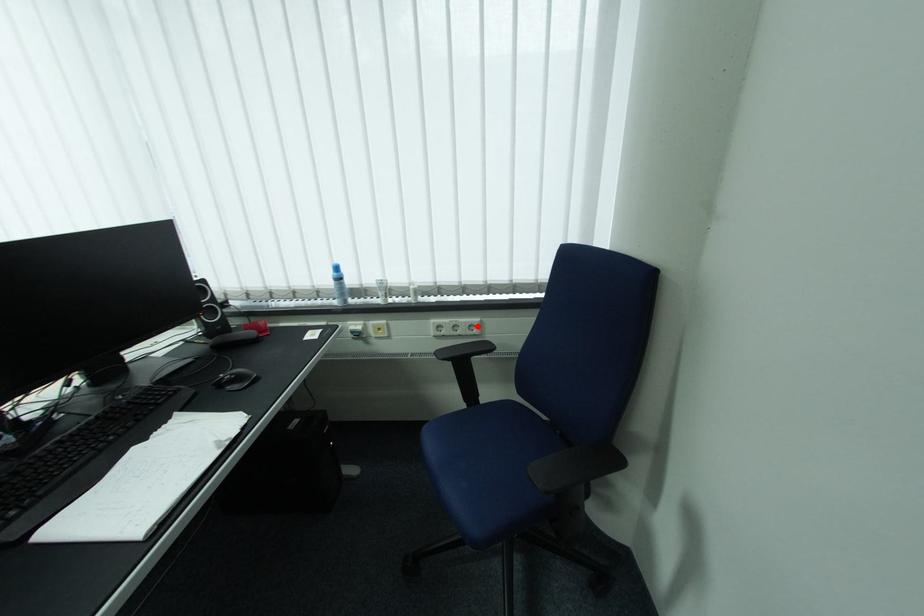
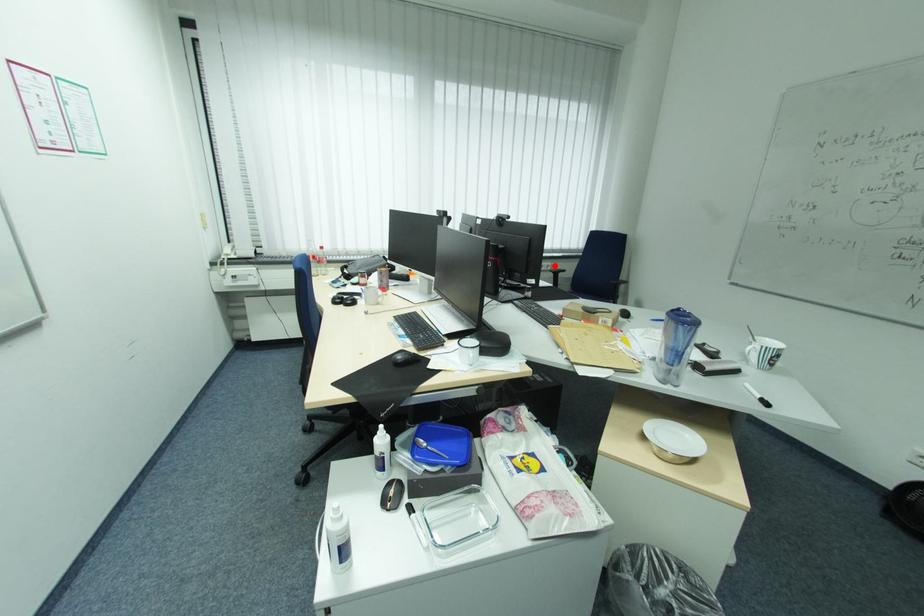
I am providing you with two images of the same scene from different viewpoints. A red point is marked on the first image and another point is marked on the second image. Do the highlighted points in image1 and image2 indicate the same real-world spot?

Yes